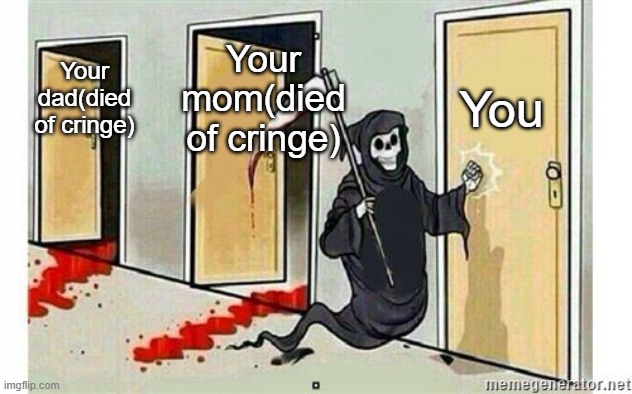
Image resolution: width=632 pixels, height=394 pixels. What are the coordinates of `closed door` in the screenshot? It's located at (528, 208).